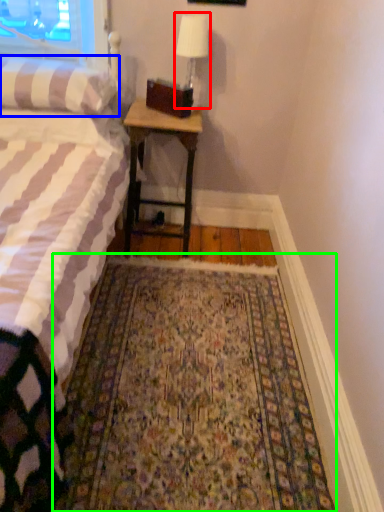
Question: Considering the real-world distances, which object is closest to bedside lamp (highlighted by a red box)? pillow (highlighted by a blue box) or mat (highlighted by a green box).

Choices:
 (A) pillow
 (B) mat

Answer: (A)